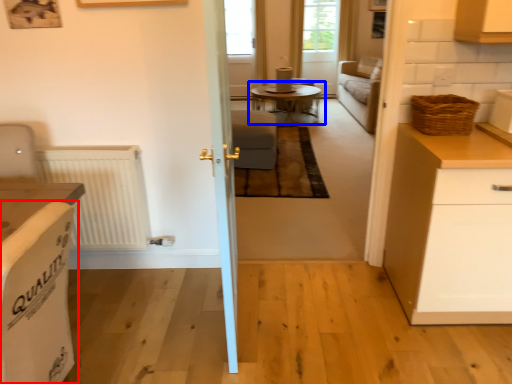
Question: Which object is further to the camera taking this photo, armchair (highlighted by a red box) or table (highlighted by a blue box)?

Choices:
 (A) armchair
 (B) table

Answer: (B)